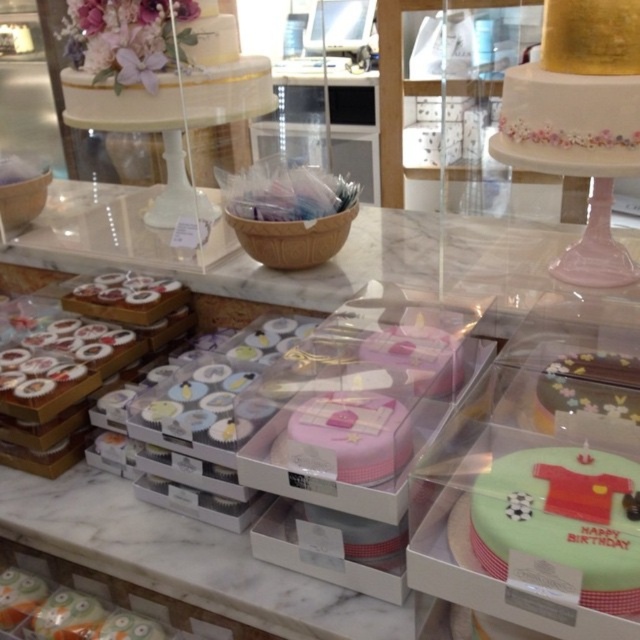
Who is positioned more to the right, green matte cake at lower right or pink matte cake at center?

green matte cake at lower right is more to the right.

Find the location of a particular element. green matte cake at lower right is located at coordinates (563, 518).

Does pink matte cupcake at center appear on the left side of green frosted cake at lower right?

Correct, you'll find pink matte cupcake at center to the left of green frosted cake at lower right.

Is pink matte cupcake at center positioned behind green frosted cake at lower right?

No, it is not.

Between point (352, 440) and point (636, 364), which one is positioned behind?

Positioned behind is point (636, 364).

Find the location of `pink matte cupcake at center`. pink matte cupcake at center is located at coordinates (346, 436).

Which is above, green matte cake at lower right or green frosted cake at lower right?

green frosted cake at lower right is higher up.

Consider the image. Does green matte cake at lower right have a smaller size compared to green frosted cake at lower right?

Incorrect, green matte cake at lower right is not smaller in size than green frosted cake at lower right.

Image resolution: width=640 pixels, height=640 pixels. What do you see at coordinates (563, 518) in the screenshot?
I see `green matte cake at lower right` at bounding box center [563, 518].

What are the coordinates of `green matte cake at lower right` in the screenshot? It's located at (563, 518).